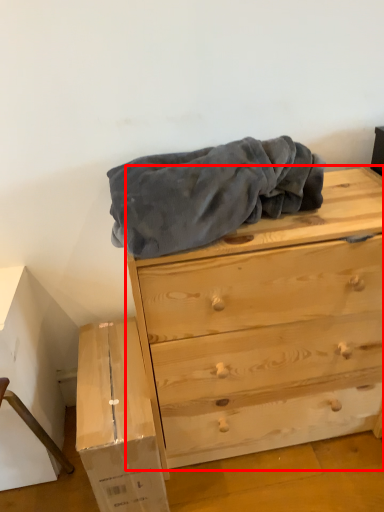
Question: Observing the image, what is the correct spatial positioning of chest of drawers (annotated by the red box) in reference to cardboard box?

Choices:
 (A) right
 (B) left

Answer: (A)